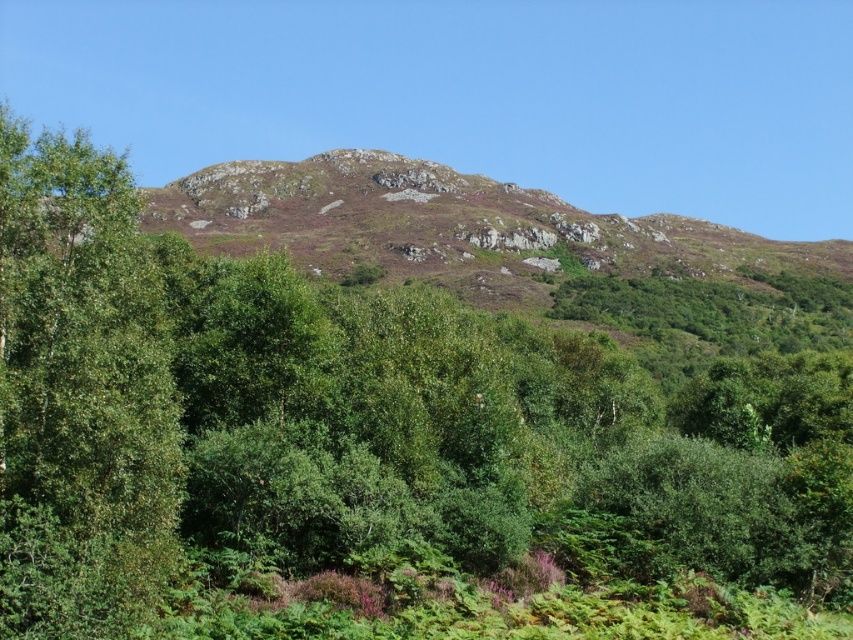
Question: Can you confirm if green leafy tree at left is smaller than rusty rock mountain at center?

Choices:
 (A) no
 (B) yes

Answer: (B)

Question: Which point is farther from the camera taking this photo?

Choices:
 (A) (47, 577)
 (B) (722, 227)

Answer: (B)

Question: Can you confirm if green leafy tree at left is positioned to the right of rusty rock mountain at center?

Choices:
 (A) yes
 (B) no

Answer: (B)

Question: Does green leafy tree at left appear on the left side of rusty rock mountain at center?

Choices:
 (A) yes
 (B) no

Answer: (A)

Question: Among these objects, which one is nearest to the camera?

Choices:
 (A) rusty rock mountain at center
 (B) green leafy tree at left

Answer: (B)

Question: Which object appears farthest from the camera in this image?

Choices:
 (A) rusty rock mountain at center
 (B) green leafy tree at left

Answer: (A)